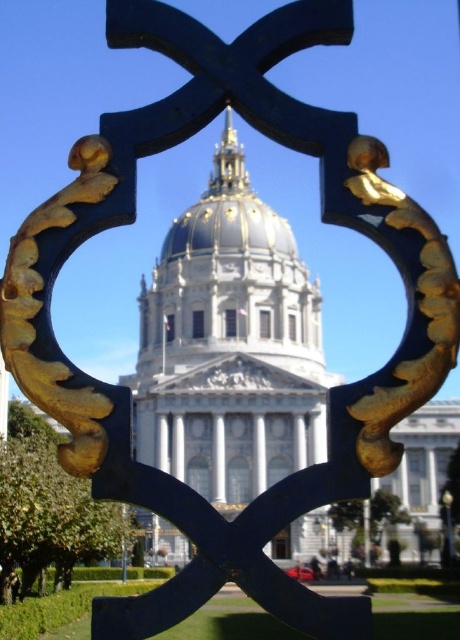
Question: Which point appears closest to the camera in this image?

Choices:
 (A) (197, 230)
 (B) (205, 285)

Answer: (B)

Question: Can you confirm if white marble cathedral at center is positioned above gold/gilded dome at center?

Choices:
 (A) yes
 (B) no

Answer: (B)

Question: Does white marble cathedral at center appear over gold/gilded dome at center?

Choices:
 (A) yes
 (B) no

Answer: (B)

Question: From the image, what is the correct spatial relationship of white marble cathedral at center in relation to gold/gilded dome at center?

Choices:
 (A) above
 (B) below

Answer: (B)